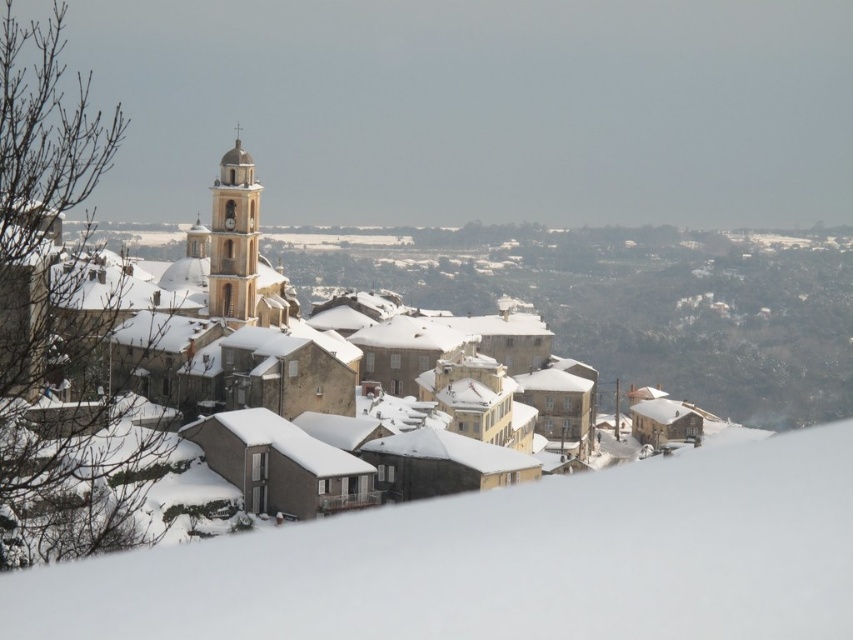
Which is above, snow-covered stone village at center or smooth stone bell tower at center?

smooth stone bell tower at center is above.

Can you confirm if snow-covered stone village at center is wider than smooth stone bell tower at center?

Yes, snow-covered stone village at center is wider than smooth stone bell tower at center.

Does point (190, 410) come closer to viewer compared to point (215, 310)?

That is True.

Identify the location of snow-covered stone village at center. (283, 348).